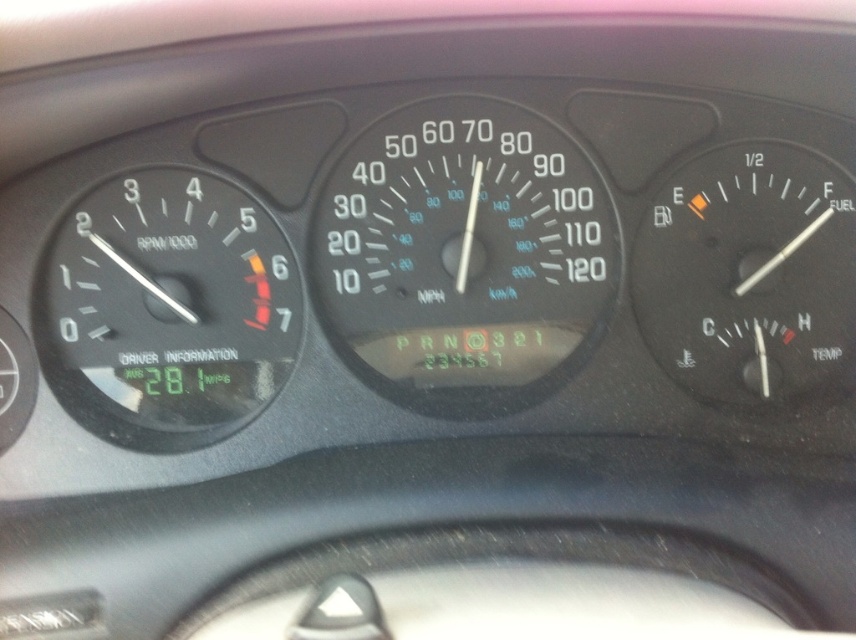
You are a mechanic trying to install a new speedometer in the car. The new speedometer is 30 centimeters wide. The current space between the white plastic speedometer at center and the black plastic speedometer at left is 29.10 centimeters. Will the new speedometer fit in the space between them?

The space between the white plastic speedometer at center and the black plastic speedometer at left is 29.10 centimeters, which is narrower than the new speedometer that is 30 centimeters wide. Therefore, the new speedometer will not fit in the space between them.

Based on the coordinates provided, which object is located at point (464, 256) on the car dashboard?

The point (464, 256) corresponds to the white plastic speedometer at center.

You are standing at the camera position and want to reach point (x=250, y=243). Is the distance less than 6 feet?

Yes, the distance between point (x=250, y=243) and the camera is 5.19 feet, which is less than 6 feet.